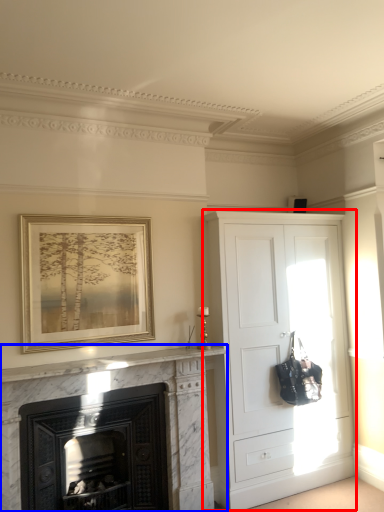
Question: Which of the following is the closest to the observer, cupboard (highlighted by a red box) or fireplace (highlighted by a blue box)?

Choices:
 (A) cupboard
 (B) fireplace

Answer: (B)